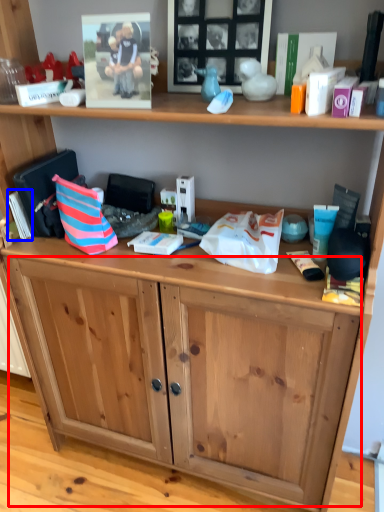
Question: Which object appears farthest to the camera in this image, drawer (highlighted by a red box) or book (highlighted by a blue box)?

Choices:
 (A) drawer
 (B) book

Answer: (B)